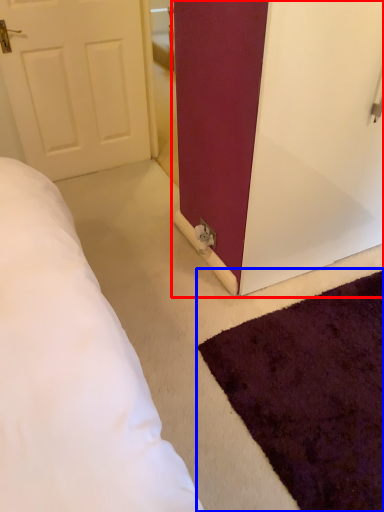
Question: Which point is closer to the camera, door (highlighted by a red box) or mat (highlighted by a blue box)?

Choices:
 (A) door
 (B) mat

Answer: (B)